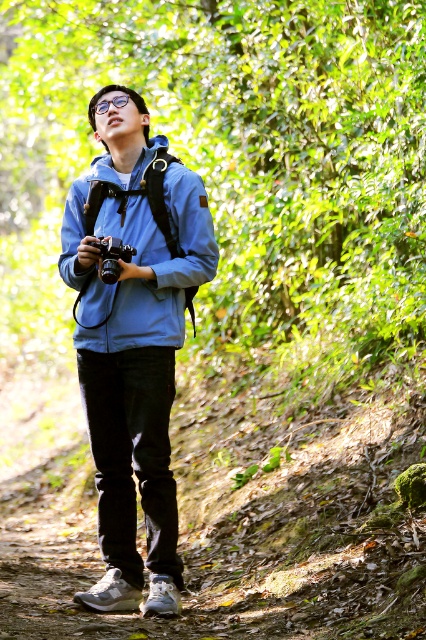
Question: Considering the real-world distances, which object is farthest from the matte black camera at center?

Choices:
 (A) matte blue jacket at center
 (B) brown dirt path at center
 (C) blue fabric jacket at center

Answer: (B)

Question: Does brown dirt path at center have a lesser width compared to matte blue jacket at center?

Choices:
 (A) yes
 (B) no

Answer: (B)

Question: Is brown dirt path at center to the right of blue fabric jacket at center from the viewer's perspective?

Choices:
 (A) yes
 (B) no

Answer: (A)

Question: Which object is positioned farthest from the brown dirt path at center?

Choices:
 (A) matte black camera at center
 (B) matte blue jacket at center
 (C) blue fabric jacket at center

Answer: (A)

Question: Which point appears closest to the camera in this image?

Choices:
 (A) pos(203,225)
 (B) pos(92,224)

Answer: (A)

Question: Does brown dirt path at center have a greater width compared to matte black camera at center?

Choices:
 (A) no
 (B) yes

Answer: (B)